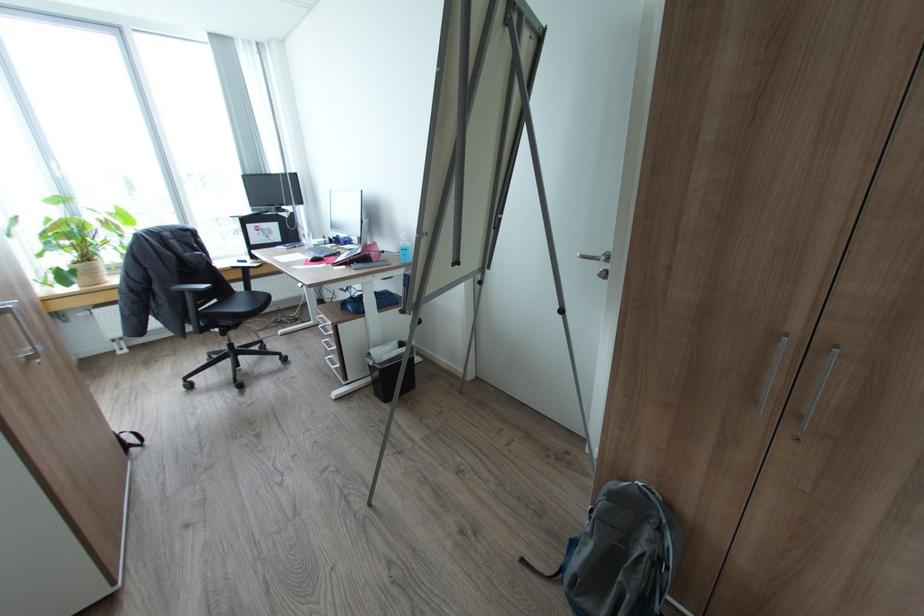
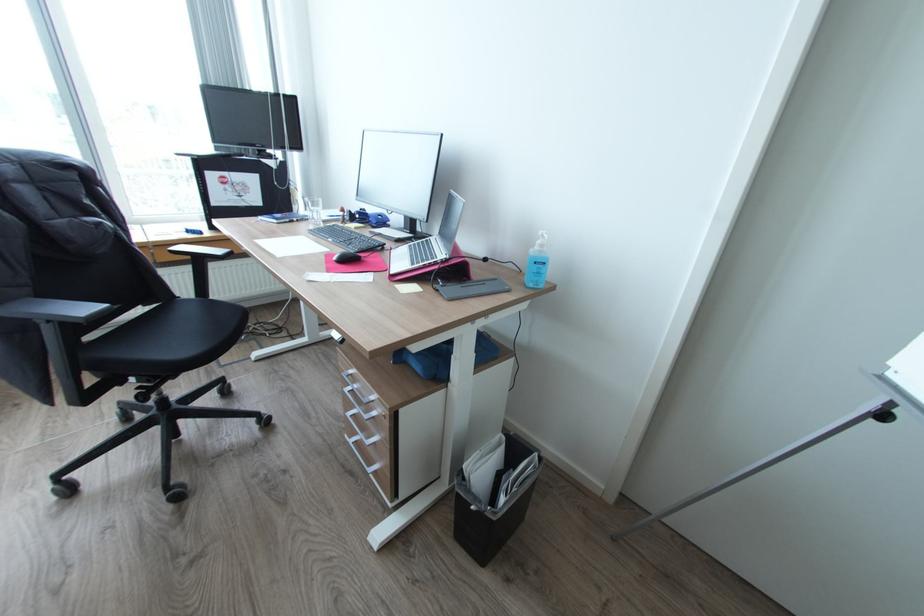
Locate, in the second image, the point that corresponds to (313,243) in the first image.

(321, 217)